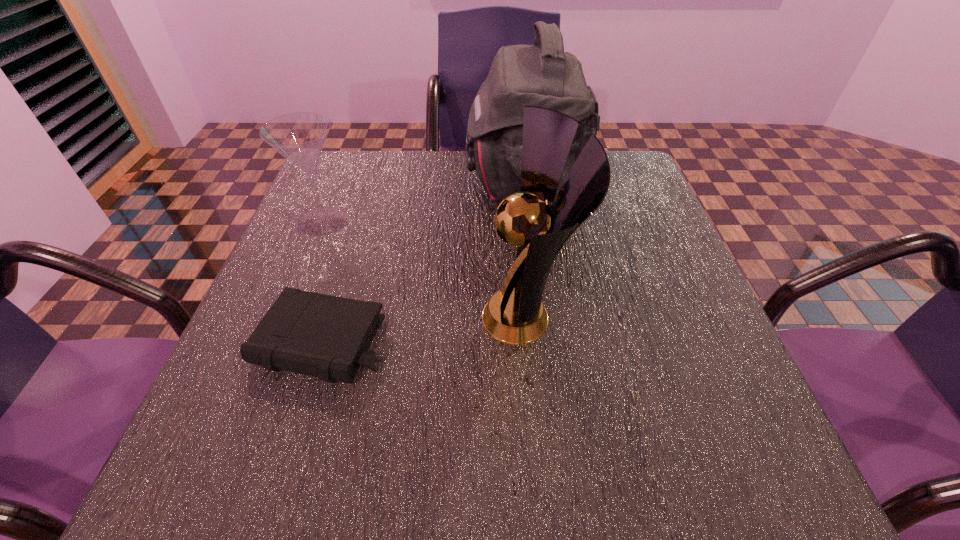
I want to click on free space between the award and the Bible, so click(x=425, y=329).

Identify the location of unoccupied position between the shortest object and the award. This screenshot has height=540, width=960. [x=425, y=329].

You are a GUI agent. You are given a task and a screenshot of the screen. Output one action in this format:
    pyautogui.click(x=<x>, y=<y>)
    Task: Click on the vacant area that lies between the flute glass and the award
    Image resolution: width=960 pixels, height=540 pixels.
    Given the screenshot: What is the action you would take?
    pyautogui.click(x=426, y=268)

What are the coordinates of `free space that is in between the second shortest object and the award` in the screenshot? It's located at (426, 268).

This screenshot has width=960, height=540. In order to click on empty location between the Bible and the second shortest object in this screenshot , I will do pos(324,281).

Identify the location of unoccupied area between the Bible and the shoulder bag. (424, 263).

I want to click on empty space that is in between the award and the Bible, so click(x=425, y=329).

Find the location of a particular element. vacant area that lies between the second shortest object and the shoulder bag is located at coordinates (424, 202).

The height and width of the screenshot is (540, 960). I want to click on free space that is in between the shoulder bag and the Bible, so tap(424, 263).

Where is `free space between the Bible and the award`? The height and width of the screenshot is (540, 960). free space between the Bible and the award is located at coordinates (425, 329).